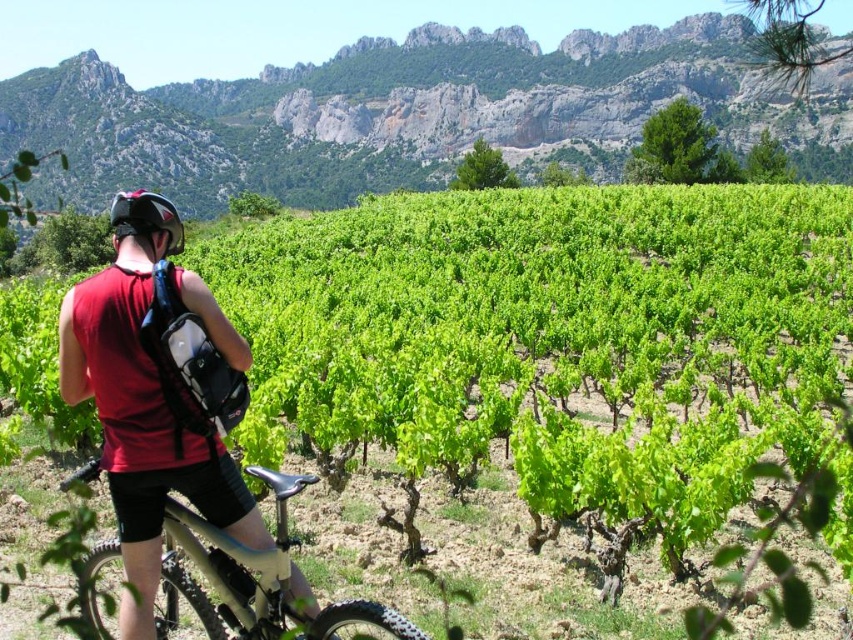
Can you confirm if matte black tank top at left is wider than matte black helmet at upper left?

Incorrect, matte black tank top at left's width does not surpass matte black helmet at upper left's.

Between matte black tank top at left and matte black helmet at upper left, which one is positioned lower?

matte black tank top at left is lower down.

This screenshot has width=853, height=640. What are the coordinates of `matte black tank top at left` in the screenshot? It's located at (143, 426).

Which is above, green leafy vines at center or matte black tank top at left?

green leafy vines at center is above.

What do you see at coordinates (558, 342) in the screenshot? The width and height of the screenshot is (853, 640). I see `green leafy vines at center` at bounding box center [558, 342].

Image resolution: width=853 pixels, height=640 pixels. What do you see at coordinates (558, 342) in the screenshot?
I see `green leafy vines at center` at bounding box center [558, 342].

Where is `green leafy vines at center`? green leafy vines at center is located at coordinates (558, 342).

Is point (259, 545) positioned in front of point (194, 554)?

No, (259, 545) is further to viewer.

How distant is matte black tank top at left from metallic silver frame at center?

matte black tank top at left is 8.26 feet from metallic silver frame at center.

Is point (141, 528) farther from viewer compared to point (239, 593)?

Yes, point (141, 528) is farther from viewer.

What are the coordinates of `matte black tank top at left` in the screenshot? It's located at (143, 426).